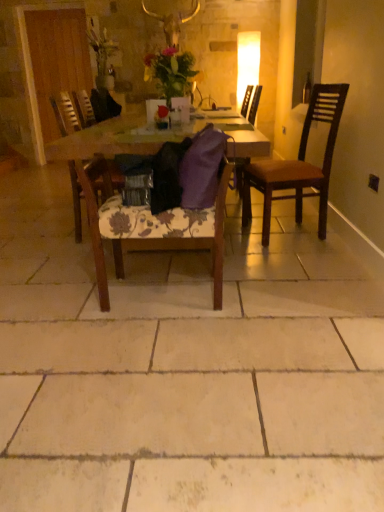
At what (x,y) coordinates should I click in order to perform the action: click on unoccupied area in front of wooden chair at center, the first chair positioned from the left. Please return your answer as a coordinate pair (x, y). Looking at the image, I should click on (79, 258).